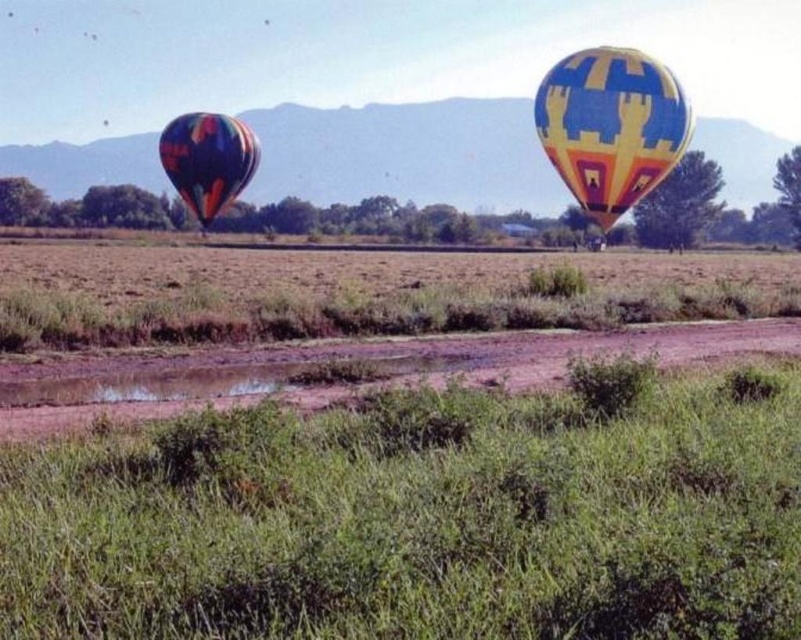
Question: Which of the following is the closest to the observer?

Choices:
 (A) multicolored fabric balloon at left
 (B) yellow and blue patterned hot air balloon at upper right

Answer: (B)

Question: Is yellow and blue patterned hot air balloon at upper right to the right of multicolored fabric balloon at left from the viewer's perspective?

Choices:
 (A) no
 (B) yes

Answer: (B)

Question: Where is yellow and blue patterned hot air balloon at upper right located in relation to multicolored fabric balloon at left in the image?

Choices:
 (A) right
 (B) left

Answer: (A)

Question: Does yellow and blue patterned hot air balloon at upper right have a smaller size compared to multicolored fabric balloon at left?

Choices:
 (A) yes
 (B) no

Answer: (A)

Question: Which object is closer to the camera taking this photo?

Choices:
 (A) yellow and blue patterned hot air balloon at upper right
 (B) multicolored fabric balloon at left

Answer: (A)